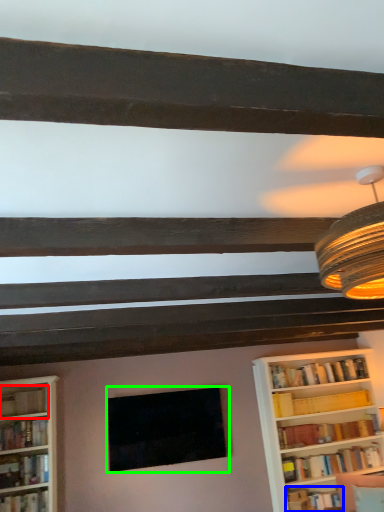
Question: Based on their relative distances, which object is nearer to book (highlighted by a red box)? Choose from book (highlighted by a blue box) and picture frame (highlighted by a green box).

Choices:
 (A) book
 (B) picture frame

Answer: (B)